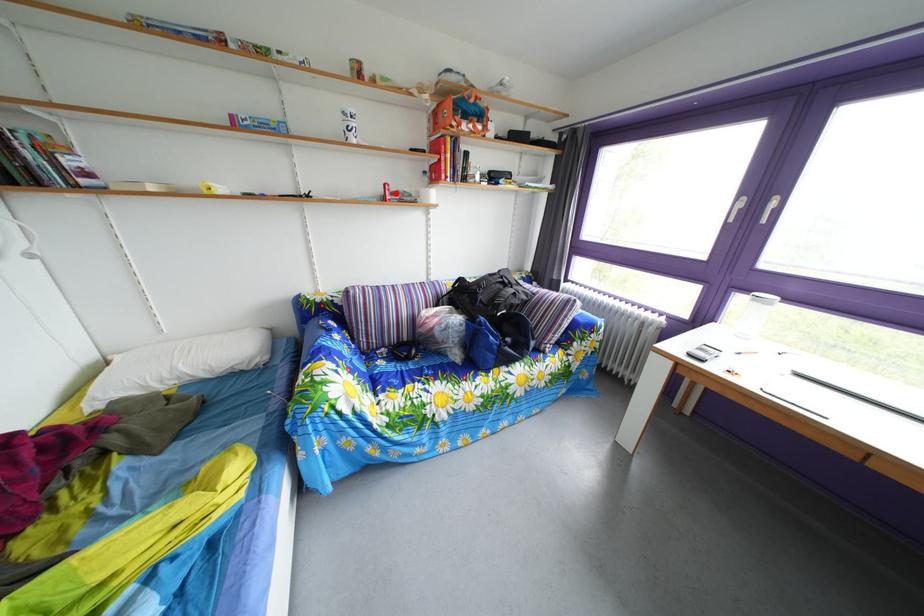
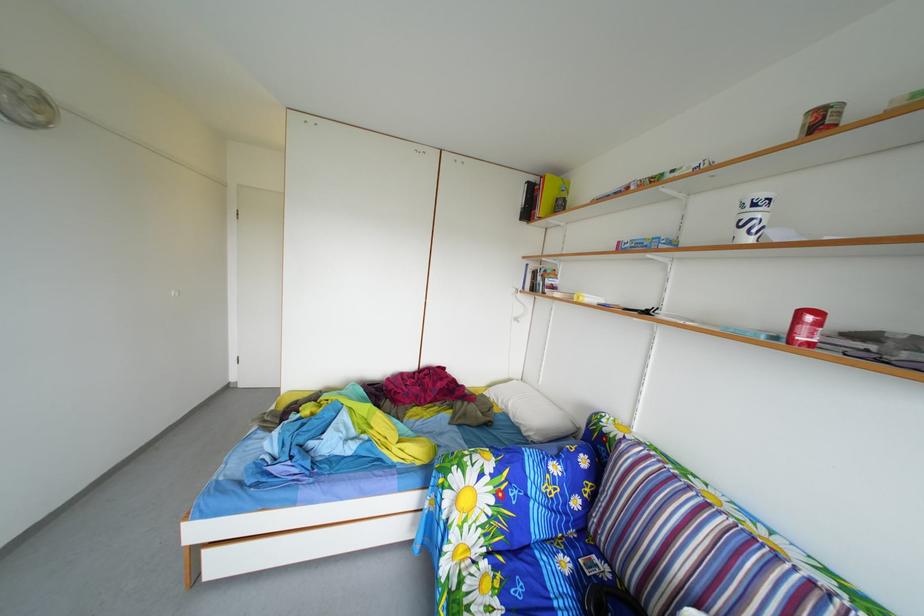
The point at the highlighted location is marked in the first image. Where is the corresponding point in the second image?

(811, 321)